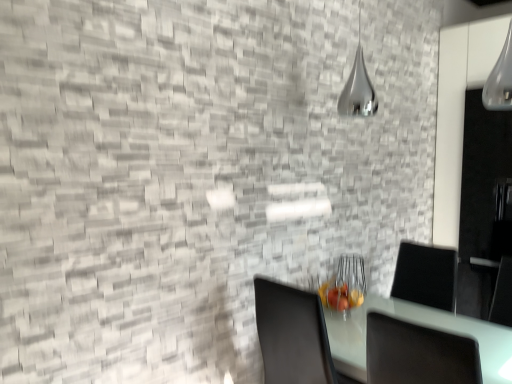
Where is `silver metallic lamp at upper center`? silver metallic lamp at upper center is located at coordinates (358, 88).

Describe the element at coordinates (358, 88) in the screenshot. I see `silver metallic lamp at upper center` at that location.

The width and height of the screenshot is (512, 384). What do you see at coordinates (420, 324) in the screenshot?
I see `white glossy table at lower right` at bounding box center [420, 324].

This screenshot has height=384, width=512. Find the location of `silver metallic lamp at upper center`. silver metallic lamp at upper center is located at coordinates (358, 88).

Who is taller, white glossy table at lower right or silver metallic lamp at upper center?

silver metallic lamp at upper center.

Find the location of a particular element. The height and width of the screenshot is (384, 512). table located underneath the silver metallic lamp at upper center (from a real-world perspective) is located at coordinates (420, 324).

Is point (432, 312) positioned after point (366, 98)?

That is False.

Does point (509, 161) come farther from viewer compared to point (475, 333)?

Yes, point (509, 161) is farther from viewer.

Are transparent glass door at right and white glossy table at lower right beside each other?

No.

Which of these two, transparent glass door at right or white glossy table at lower right, is wider?

transparent glass door at right is wider.

From the image's perspective, which one is positioned higher, transparent glass door at right or white glossy table at lower right?

transparent glass door at right, from the image's perspective.

From the image's perspective, is transparent glass door at right located above or below silver metallic lamp at upper center?

From the image's perspective, transparent glass door at right appears below silver metallic lamp at upper center.

Image resolution: width=512 pixels, height=384 pixels. Find the location of `lamp in front of the transparent glass door at right`. lamp in front of the transparent glass door at right is located at coordinates (358, 88).

Which is more to the right, white glossy table at lower right or transparent glass door at right?

Positioned to the right is transparent glass door at right.

Looking at this image, does white glossy table at lower right come behind transparent glass door at right?

No, the depth of white glossy table at lower right is less than that of transparent glass door at right.

Identify the location of glass door that is above the white glossy table at lower right (from a real-world perspective). The width and height of the screenshot is (512, 384). (483, 204).

Consider the image. Considering the sizes of objects white glossy table at lower right and transparent glass door at right in the image provided, who is thinner, white glossy table at lower right or transparent glass door at right?

white glossy table at lower right is thinner.

In the scene shown: Between silver metallic lamp at upper center and white glossy table at lower right, which one has larger size?

With larger size is white glossy table at lower right.

Considering the relative sizes of silver metallic lamp at upper center and white glossy table at lower right in the image provided, is silver metallic lamp at upper center wider than white glossy table at lower right?

Incorrect, the width of silver metallic lamp at upper center does not surpass that of white glossy table at lower right.

How different are the orientations of silver metallic lamp at upper center and white glossy table at lower right in degrees?

93 degrees separate the facing orientations of silver metallic lamp at upper center and white glossy table at lower right.

Is silver metallic lamp at upper center facing away from white glossy table at lower right?

No, silver metallic lamp at upper center's orientation is not away from white glossy table at lower right.

Could you tell me if silver metallic lamp at upper center is turned towards transparent glass door at right?

No, silver metallic lamp at upper center is not oriented towards transparent glass door at right.

Is silver metallic lamp at upper center bigger than transparent glass door at right?

Incorrect, silver metallic lamp at upper center is not larger than transparent glass door at right.

From the image's perspective, is silver metallic lamp at upper center positioned above or below transparent glass door at right?

silver metallic lamp at upper center is situated higher than transparent glass door at right in the image.

Which of these two, silver metallic lamp at upper center or transparent glass door at right, is wider?

transparent glass door at right.

Where is `table that is on the right side of silver metallic lamp at upper center`? table that is on the right side of silver metallic lamp at upper center is located at coordinates (420, 324).

Where is `glass door that appears behind the white glossy table at lower right`? The height and width of the screenshot is (384, 512). glass door that appears behind the white glossy table at lower right is located at coordinates (483, 204).

Looking at the image, which one is located closer to transparent glass door at right, white glossy table at lower right or silver metallic lamp at upper center?

The object closer to transparent glass door at right is white glossy table at lower right.

Considering their positions, is silver metallic lamp at upper center positioned further to white glossy table at lower right than transparent glass door at right?

silver metallic lamp at upper center lies further to white glossy table at lower right than the other object.

Considering their positions, is silver metallic lamp at upper center positioned further to transparent glass door at right than white glossy table at lower right?

silver metallic lamp at upper center is further to transparent glass door at right.

Estimate the real-world distances between objects in this image. Which object is closer to silver metallic lamp at upper center, transparent glass door at right or white glossy table at lower right?

transparent glass door at right.

Which object lies further to the anchor point silver metallic lamp at upper center, white glossy table at lower right or transparent glass door at right?

Based on the image, white glossy table at lower right appears to be further to silver metallic lamp at upper center.

When comparing their distances from white glossy table at lower right, does transparent glass door at right or silver metallic lamp at upper center seem closer?

transparent glass door at right is positioned closer to the anchor white glossy table at lower right.

Locate an element on the screen. This screenshot has height=384, width=512. lamp located between white glossy table at lower right and transparent glass door at right in the depth direction is located at coordinates (358, 88).